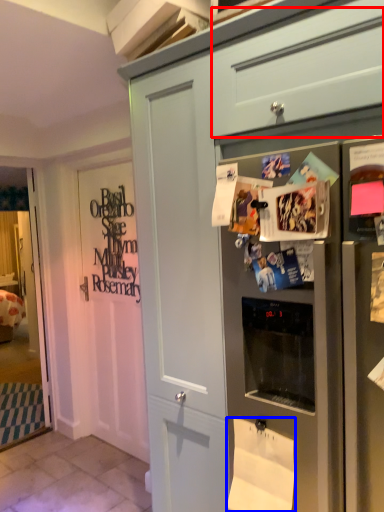
Question: Which object is closer to the camera taking this photo, drawer (highlighted by a red box) or toilet paper (highlighted by a blue box)?

Choices:
 (A) drawer
 (B) toilet paper

Answer: (A)